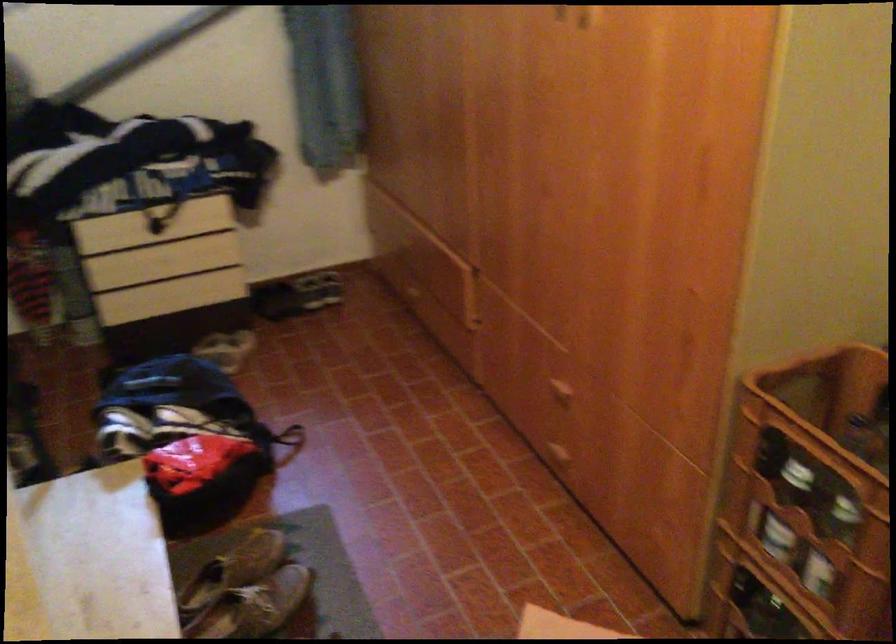
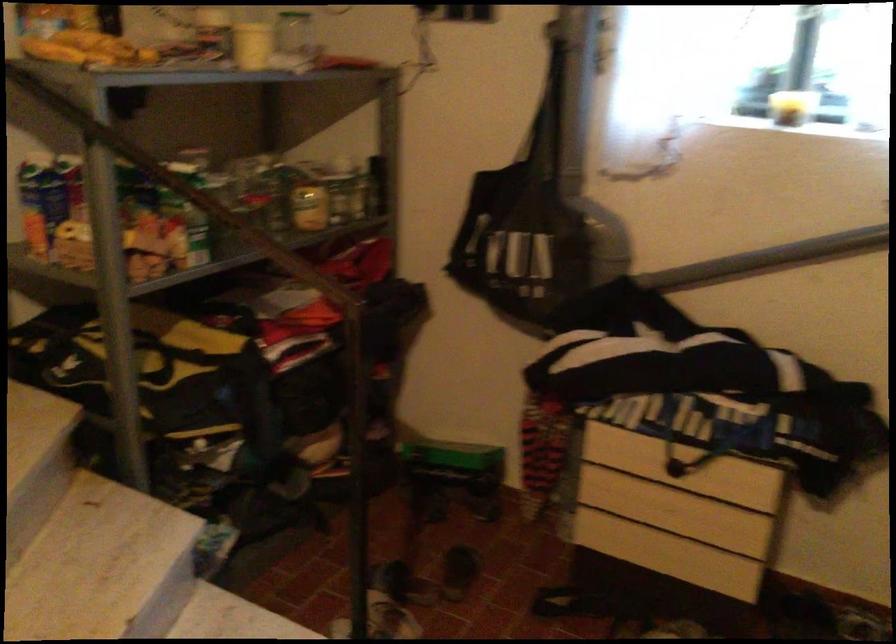
Locate, in the second image, the point that corresponds to the point at 173,267 in the first image.

(668, 518)